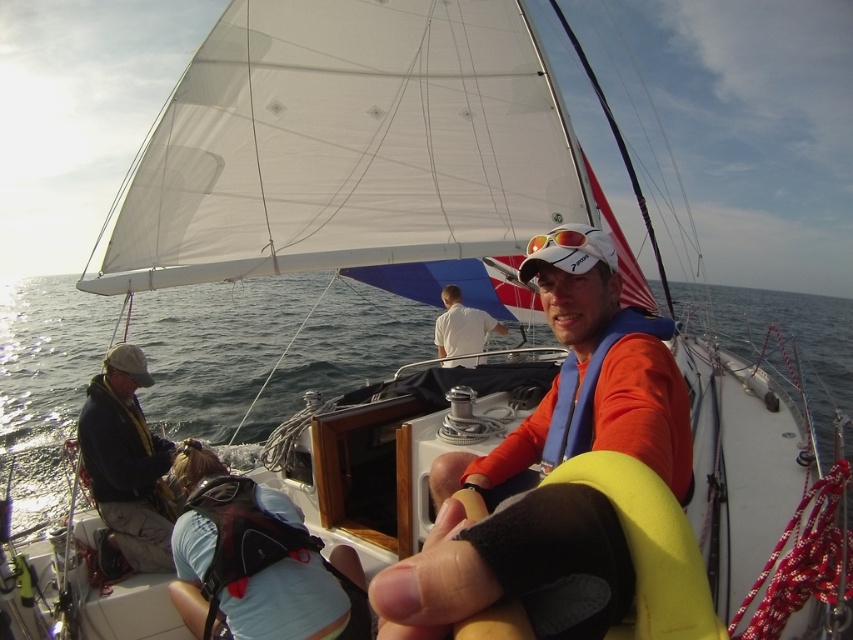
You are a sailor on the boat and need to determine which clothing item is taller between the dark blue fabric jacket at left and the white cotton shirt at center. Which one is taller?

The dark blue fabric jacket at left is taller than the white cotton shirt at center.

You are a sailor on the deck of the sailboat. You need to retrieve the orange fabric life vest at center and the dark blue fabric jacket at left. Which item is positioned higher relative to the deck?

The orange fabric life vest at center is above the dark blue fabric jacket at left, so it is positioned higher relative to the deck.